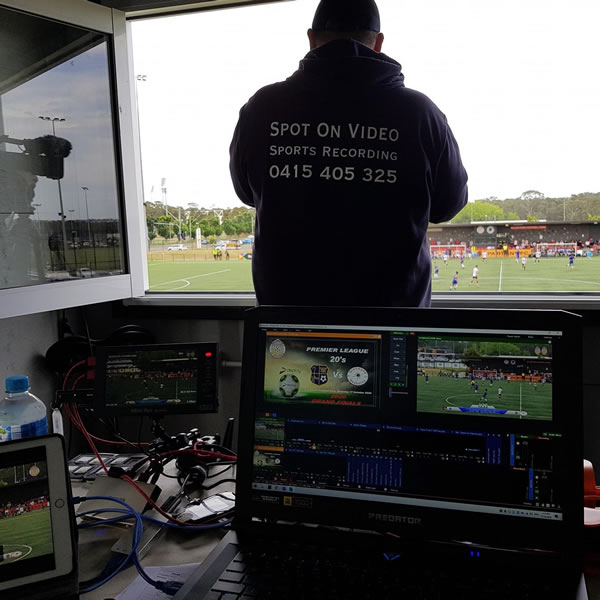
Image resolution: width=600 pixels, height=600 pixels. Find the location of `recording monitor`. recording monitor is located at coordinates (164, 385).